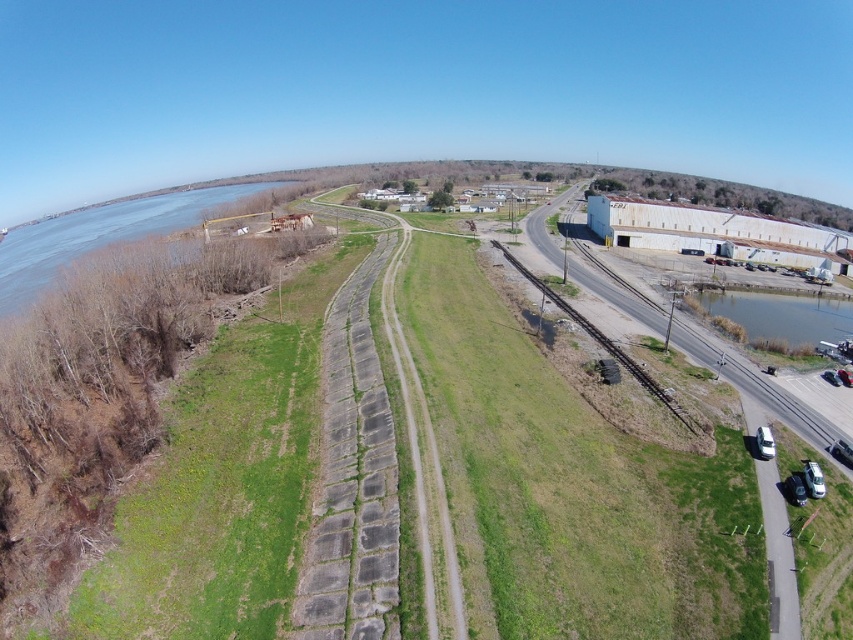
Between blue water at left and rusty metal train track at lower right, which one has more height?

Standing taller between the two is blue water at left.

Does blue water at left have a greater width compared to rusty metal train track at lower right?

Correct, the width of blue water at left exceeds that of rusty metal train track at lower right.

Is point (51, 237) positioned after point (648, 388)?

Yes, point (51, 237) is farther from viewer.

I want to click on blue water at left, so click(x=99, y=236).

Does clear water at lower right appear over rusty metal train track at lower right?

Correct, clear water at lower right is located above rusty metal train track at lower right.

Does point (775, 308) come in front of point (685, 424)?

No, it is behind (685, 424).

Identify the location of clear water at lower right. This screenshot has width=853, height=640. (781, 314).

Can you confirm if blue water at left is positioned to the left of clear water at lower right?

Indeed, blue water at left is positioned on the left side of clear water at lower right.

Is blue water at left positioned in front of clear water at lower right?

No, blue water at left is further to the viewer.

Is point (117, 218) behind point (816, 324)?

Yes, point (117, 218) is farther from viewer.

In order to click on blue water at left in this screenshot , I will do `click(99, 236)`.